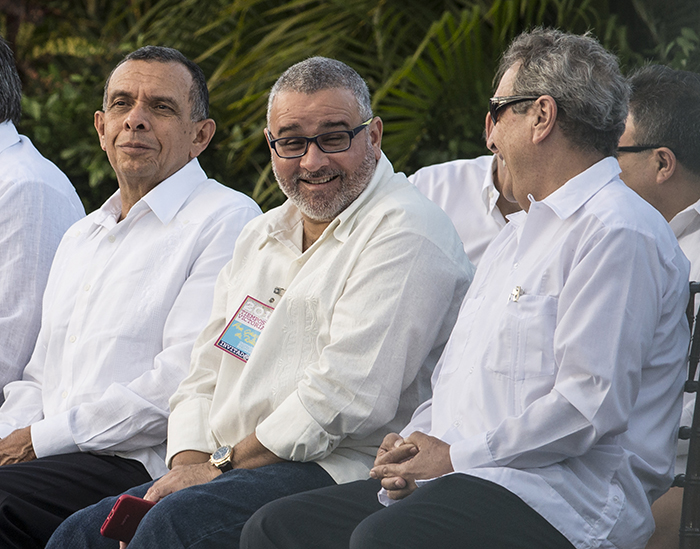
Identify the location of phone. The width and height of the screenshot is (700, 549). (116, 514).